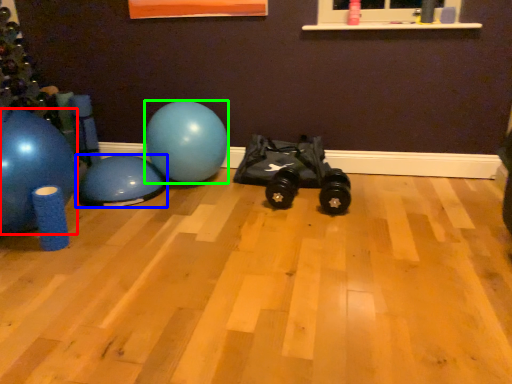
Question: Considering the real-world distances, which object is closest to ball (highlighted by a red box)? ball (highlighted by a blue box) or ball (highlighted by a green box).

Choices:
 (A) ball
 (B) ball

Answer: (A)